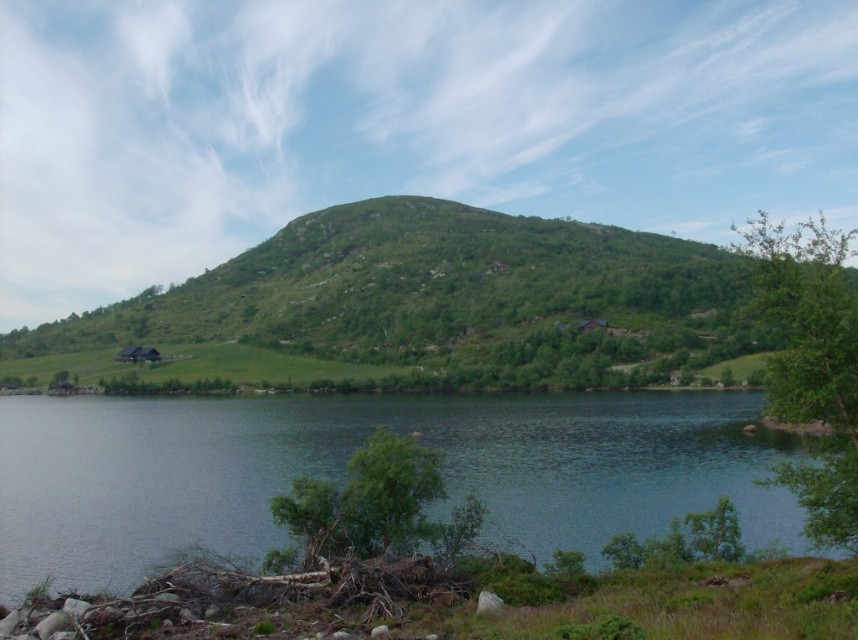
Does greenish-blue water at lower center have a greater height compared to green leafy tree at lower center?

Correct, greenish-blue water at lower center is much taller as green leafy tree at lower center.

Does greenish-blue water at lower center have a lesser height compared to green leafy tree at lower center?

Incorrect, greenish-blue water at lower center's height does not fall short of green leafy tree at lower center's.

I want to click on greenish-blue water at lower center, so click(345, 465).

This screenshot has width=858, height=640. Describe the element at coordinates (429, 307) in the screenshot. I see `green grassy hillside at center` at that location.

Describe the element at coordinates (429, 307) in the screenshot. I see `green grassy hillside at center` at that location.

What are the coordinates of `green grassy hillside at center` in the screenshot? It's located at (429, 307).

Can you confirm if green grassy hillside at center is positioned to the left of green leafy tree at lower center?

Incorrect, green grassy hillside at center is not on the left side of green leafy tree at lower center.

Is point (475, 237) less distant than point (461, 547)?

No, (475, 237) is further to viewer.

Find the location of a particular element. This screenshot has width=858, height=640. green grassy hillside at center is located at coordinates (429, 307).